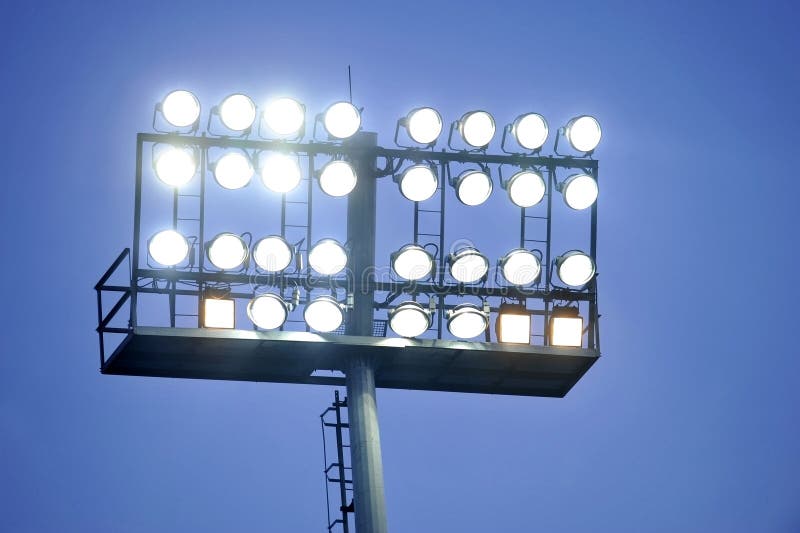
You are a GUI agent. You are given a task and a screenshot of the screen. Output one action in this format:
    pyautogui.click(x=<x>, y=<y>)
    Task: Click on the top row of lights
    The image size is (800, 533).
    Given the screenshot: What is the action you would take?
    pyautogui.click(x=173, y=113), pyautogui.click(x=241, y=121), pyautogui.click(x=289, y=124), pyautogui.click(x=336, y=126), pyautogui.click(x=420, y=131), pyautogui.click(x=473, y=134), pyautogui.click(x=534, y=135), pyautogui.click(x=577, y=139)